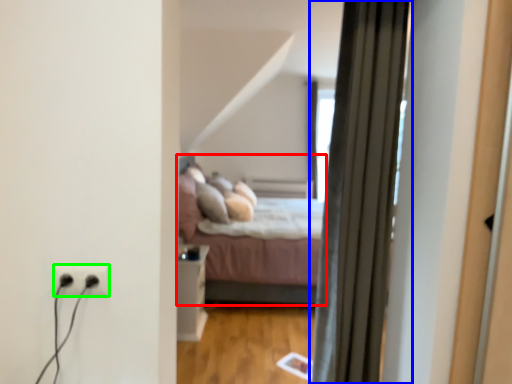
Question: Which object is positioned closest to bed (highlighted by a red box)? Select from curtain (highlighted by a blue box) and electric outlet (highlighted by a green box).

Choices:
 (A) curtain
 (B) electric outlet

Answer: (A)